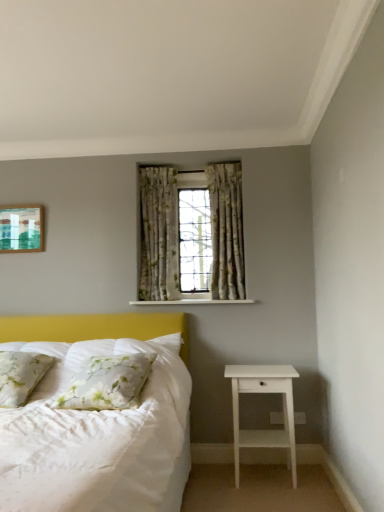
Question: Is white matte nightstand at lower right looking in the opposite direction of green floral fabric curtain at center, the 2th curtain positioned from the right?

Choices:
 (A) yes
 (B) no

Answer: (B)

Question: Is white matte nightstand at lower right wider than green floral fabric curtain at center, which is the 1th curtain in left-to-right order?

Choices:
 (A) yes
 (B) no

Answer: (A)

Question: Is the depth of white matte nightstand at lower right greater than that of green floral fabric curtain at center, which is the 1th curtain in left-to-right order?

Choices:
 (A) yes
 (B) no

Answer: (B)

Question: From a real-world perspective, does white matte nightstand at lower right sit lower than green floral fabric curtain at center, the 2th curtain positioned from the right?

Choices:
 (A) no
 (B) yes

Answer: (B)

Question: From the image's perspective, is white matte nightstand at lower right located beneath green floral fabric curtain at center, the 2th curtain positioned from the right?

Choices:
 (A) no
 (B) yes

Answer: (B)

Question: Would you say floral fabric pillow at left, the 1th pillow in the left-to-right sequence, is inside or outside green floral fabric curtain at center, the 2th curtain positioned from the right?

Choices:
 (A) outside
 (B) inside

Answer: (A)

Question: From the image's perspective, relative to green floral fabric curtain at center, which is the 1th curtain in left-to-right order, is floral fabric pillow at left, the second pillow when ordered from right to left, above or below?

Choices:
 (A) below
 (B) above

Answer: (A)

Question: Would you say floral fabric pillow at left, the 1th pillow in the left-to-right sequence, is to the left or to the right of green floral fabric curtain at center, the 2th curtain positioned from the right, in the picture?

Choices:
 (A) right
 (B) left

Answer: (B)

Question: Is floral fabric pillow at left, the 1th pillow in the left-to-right sequence, wider or thinner than green floral fabric curtain at center, the 2th curtain positioned from the right?

Choices:
 (A) thin
 (B) wide

Answer: (B)

Question: Would you say floral fabric curtains at center is inside or outside floral fabric curtain at center, the first curtain in the right-to-left sequence?

Choices:
 (A) outside
 (B) inside

Answer: (A)

Question: In the image, is floral fabric curtains at center positioned in front of or behind floral fabric curtain at center, which is the second curtain in left-to-right order?

Choices:
 (A) behind
 (B) front

Answer: (B)

Question: Is point (157, 219) closer or farther from the camera than point (228, 254)?

Choices:
 (A) farther
 (B) closer

Answer: (A)

Question: Considering the positions of floral fabric curtains at center and floral fabric curtain at center, the first curtain in the right-to-left sequence, in the image, is floral fabric curtains at center bigger or smaller than floral fabric curtain at center, the first curtain in the right-to-left sequence,?

Choices:
 (A) small
 (B) big

Answer: (B)

Question: From a real-world perspective, relative to matte green painting at upper left, is floral fabric curtain at center, the first curtain in the right-to-left sequence, vertically above or below?

Choices:
 (A) below
 (B) above

Answer: (A)

Question: In terms of height, does floral fabric curtain at center, the first curtain in the right-to-left sequence, look taller or shorter compared to matte green painting at upper left?

Choices:
 (A) short
 (B) tall

Answer: (B)